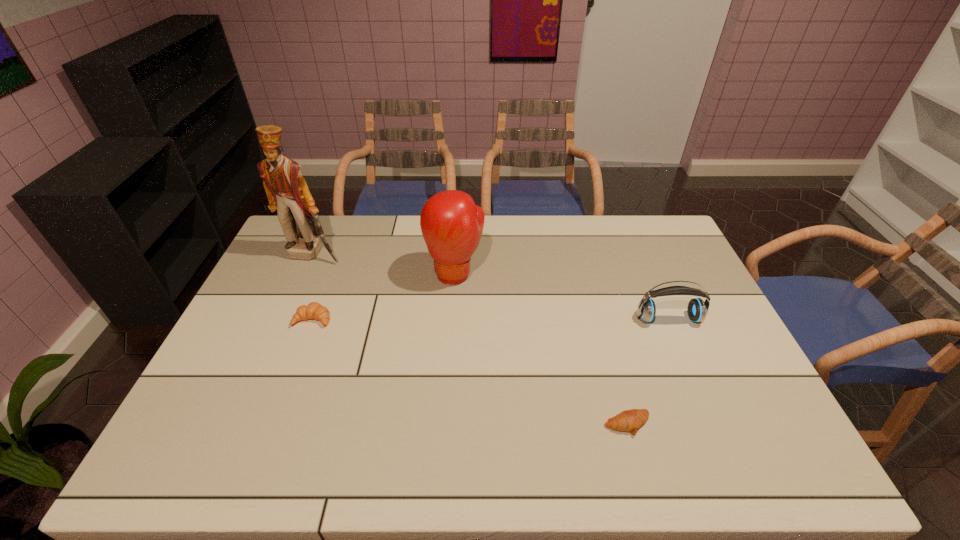
The height and width of the screenshot is (540, 960). Identify the location of vacant space located on the striking surface of the fourth shortest object. (454, 303).

The width and height of the screenshot is (960, 540). Find the location of `vacant space located on the ear cups of the third tallest object`. vacant space located on the ear cups of the third tallest object is located at coordinates (687, 363).

You are a GUI agent. You are given a task and a screenshot of the screen. Output one action in this format:
    pyautogui.click(x=<x>, y=<y>)
    Task: Click on the free region located on the front of the taller crescent roll
    The width and height of the screenshot is (960, 540).
    Given the screenshot: What is the action you would take?
    click(x=276, y=414)

This screenshot has height=540, width=960. In order to click on free location located on the left of the right crescent roll in this screenshot , I will do `click(468, 424)`.

I want to click on object situated at the far edge, so click(287, 191).

Find the location of a particular element. nutcracker that is at the left edge is located at coordinates (287, 191).

You are a GUI agent. You are given a task and a screenshot of the screen. Output one action in this format:
    pyautogui.click(x=<x>, y=<y>)
    Task: Click on the crescent roll located at the left edge
    
    Given the screenshot: What is the action you would take?
    pyautogui.click(x=314, y=310)

The image size is (960, 540). Identify the location of object present at the right edge. (697, 309).

Identify the location of object that is at the far left corner. (287, 191).

Find the location of `free space at the far edge of the desktop`. free space at the far edge of the desktop is located at coordinates (410, 254).